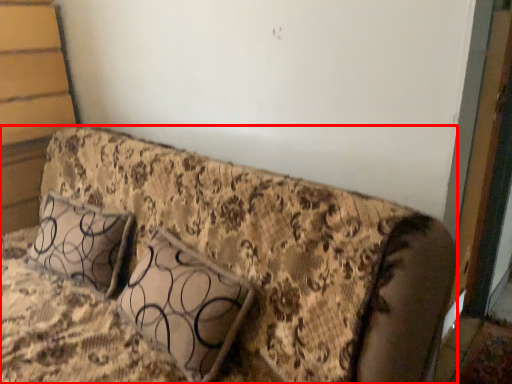
Question: From the image's perspective, considering the relative positions of furniture (annotated by the red box) and pillow in the image provided, where is furniture (annotated by the red box) located with respect to the staircase?

Choices:
 (A) below
 (B) above

Answer: (A)